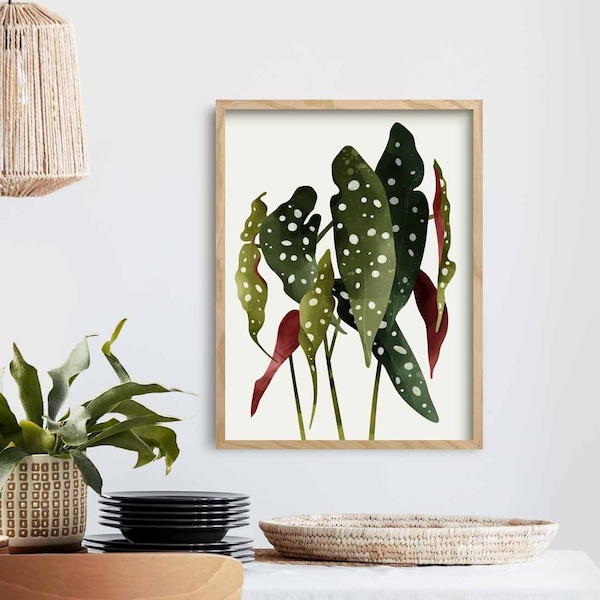
Identify the location of white wall. (436, 488).